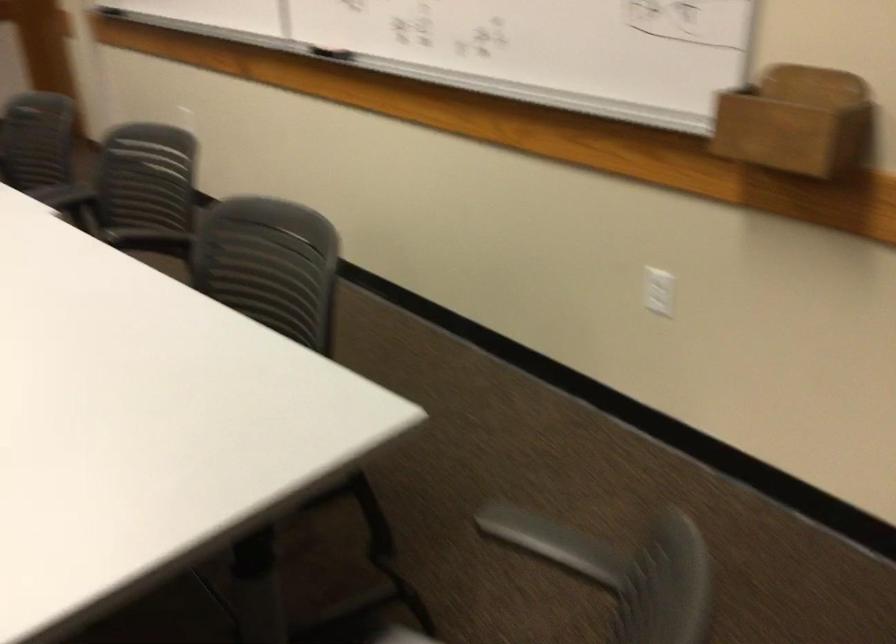
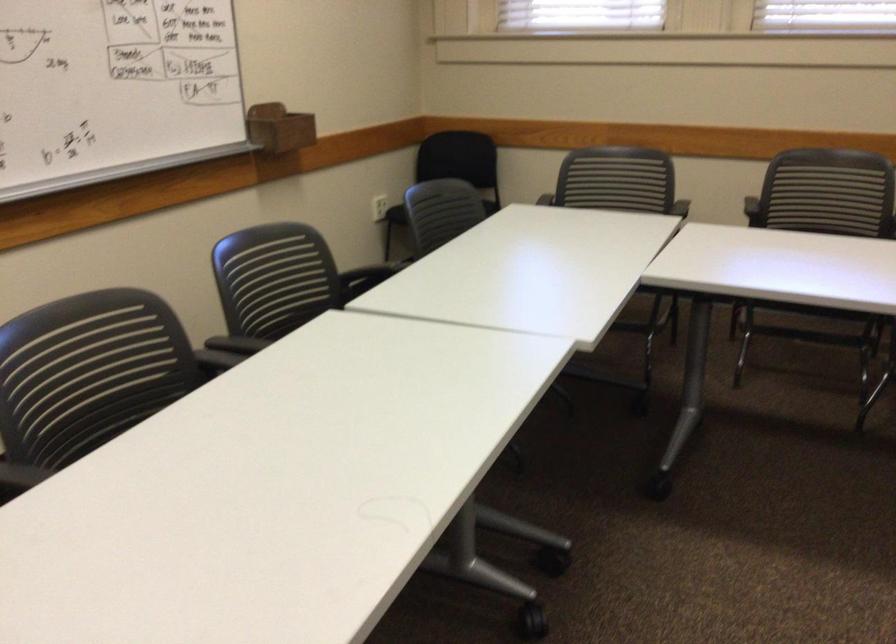
Where in the second image is the point corresponding to pixel 73 167 from the first image?

(125, 375)